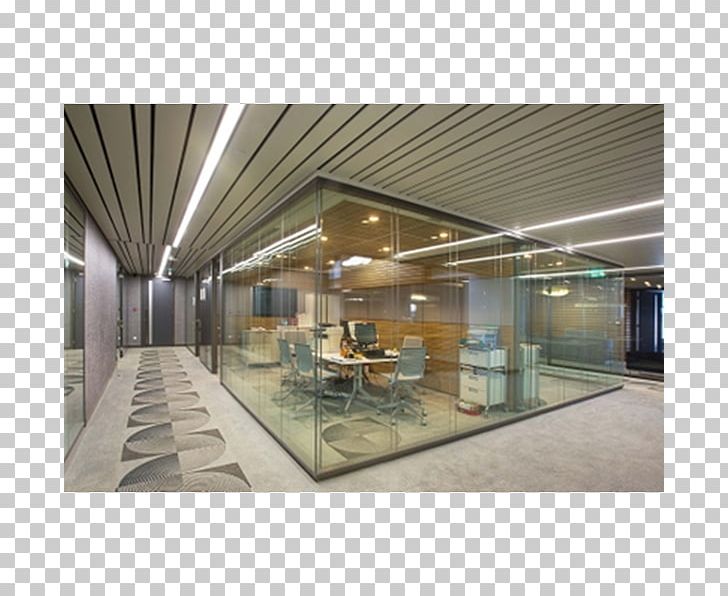
Where is `carpet`? Image resolution: width=728 pixels, height=596 pixels. carpet is located at coordinates (159, 390), (164, 462), (439, 481), (579, 439), (646, 409).